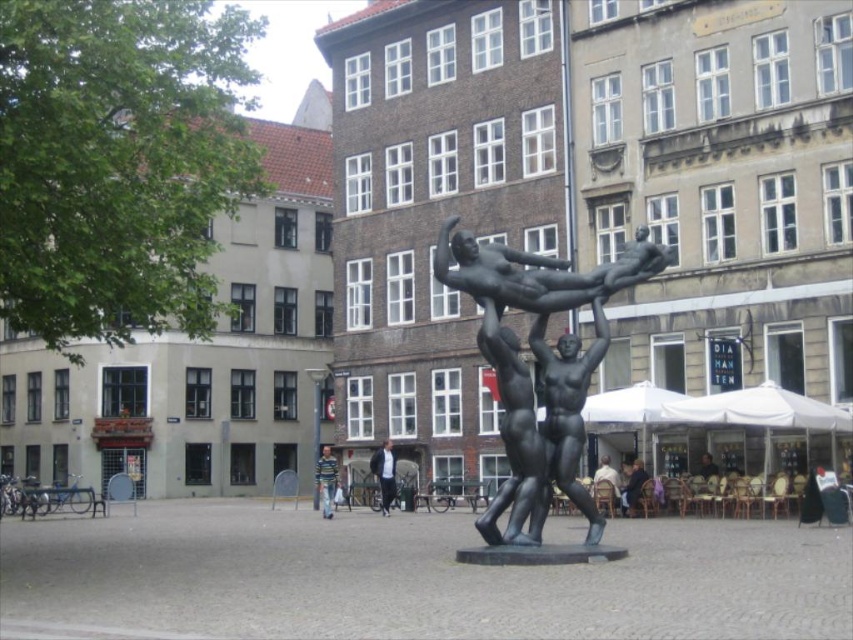
You are a tourist visiting the urban square and want to take a photo that includes both the bronze statue at center and the striped sweater at center. Since you want the statue to be the main focus, which object should you position closer to the camera to ensure it appears larger in the photo?

The bronze statue at center is larger in size than the striped sweater at center, so to make the statue the main focus, you should position the bronze statue at center closer to the camera. This will ensure it appears even larger relative to the striped sweater at center in the photo.

You are standing in the urban square and want to place a small potted plant between the dark blue jacket at center and the light brown wooden chair at lower right. Based on their positions, where should you place the plant to ensure it is between them?

The dark blue jacket at center is located below the light brown wooden chair at lower right, so placing the plant between them would require positioning it above the dark blue jacket at center and below the light brown wooden chair at lower right.

You are a photographer setting up a tripod in the urban square. You want to capture both the bronze statue at center and the light brown wooden chair at lower right in your shot. Given that the statue is larger, how might its placement affect the composition?

The bronze statue at center is larger in size than the light brown wooden chair at lower right, so positioning it centrally will draw more attention and create a dynamic contrast between the two subjects, emphasizing the statue as the focal point while the chair adds a complementary element to the composition.